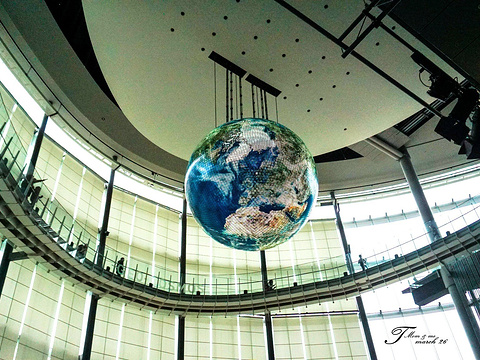
Find the location of a particular element. This screenshot has width=480, height=360. ceiling is located at coordinates (329, 128).